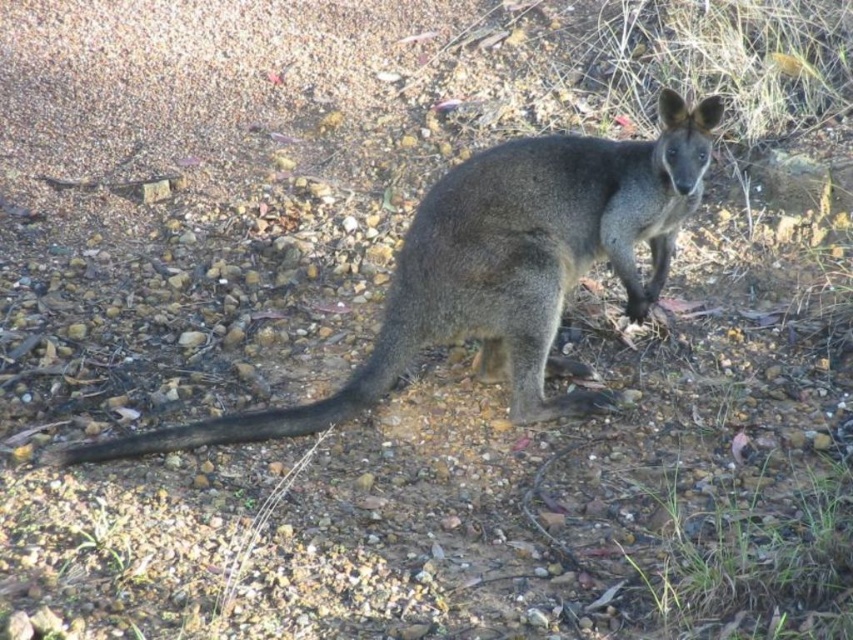
You are a photographer trying to capture the wallaby in the image. You notice two points marked on the rocky terrain. The first point is at coordinate point(279, 412) and the second point is at coordinate point(349, 380). If you want to place your camera closer to the wallaby, which coordinate should you choose?

Point(279, 412) is in front of point(349, 380), so you should choose point(279, 412) to place your camera closer to the wallaby.

You are a wildlife photographer trying to capture the gray fur kangaroo at center and the black fur tail at center in a photo. Which object should you adjust your camera focus on first if you want to ensure both are in focus, considering their sizes?

The gray fur kangaroo at center is larger in width than the black fur tail at center, so you should focus on the gray fur kangaroo at center first to ensure both are in focus.